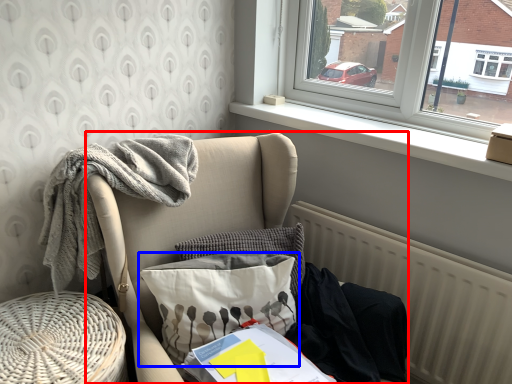
Question: Which of the following is the closest to the observer, furniture (highlighted by a red box) or pillow (highlighted by a blue box)?

Choices:
 (A) furniture
 (B) pillow

Answer: (A)